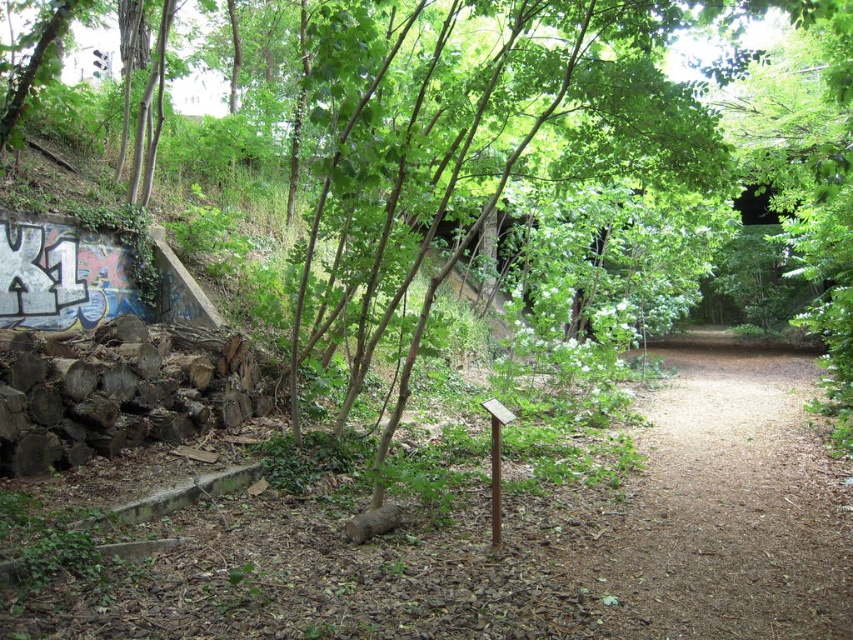
Question: Considering the relative positions of brown dirt path at center and green leafy tree at center in the image provided, where is brown dirt path at center located with respect to green leafy tree at center?

Choices:
 (A) above
 (B) below

Answer: (B)

Question: Where is brown dirt path at center located in relation to green leafy tree at center in the image?

Choices:
 (A) above
 (B) below

Answer: (B)

Question: Does brown dirt path at center lie behind green leafy tree at center?

Choices:
 (A) no
 (B) yes

Answer: (A)

Question: Which object appears closest to the camera in this image?

Choices:
 (A) green leafy tree at center
 (B) brown dirt path at center

Answer: (B)

Question: Which of the following is the farthest from the observer?

Choices:
 (A) brown dirt path at center
 (B) green leafy tree at center

Answer: (B)

Question: Which point appears farthest from the camera in this image?

Choices:
 (A) (606, 108)
 (B) (643, 442)

Answer: (B)